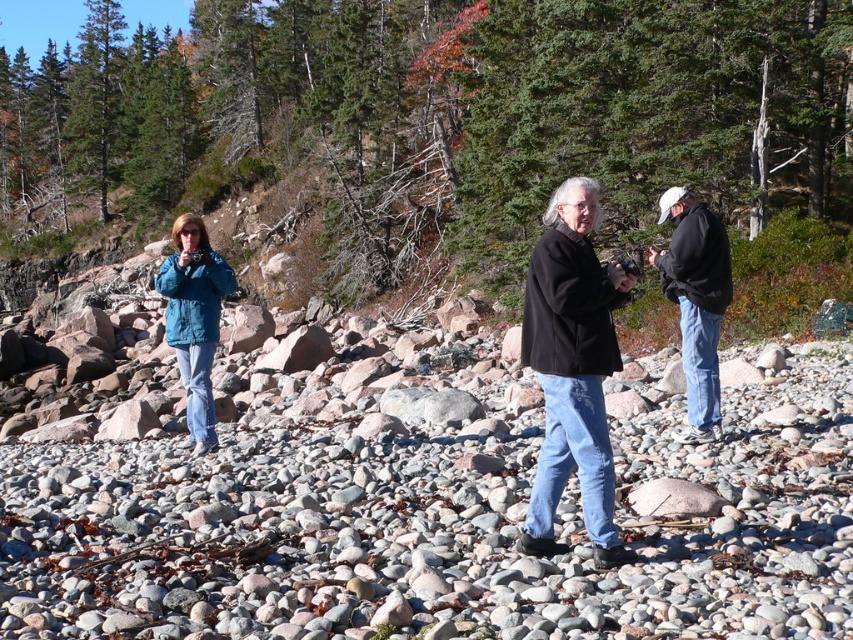
From the picture: You are standing at the point with coordinates point (701, 230) and want to walk towards the point with coordinates point (602, 554). Given the rocky terrain, will you have to move forward or backward to reach your destination?

Since point (602, 554) is in front of point (701, 230), you will need to move forward to reach it.

You are standing on the rocky beach and want to take a photo of both the black matte jacket at right and the teal matte jacket at left. Since you can only focus on one person at a time, which jacket should you focus on first to ensure the other is still in the frame?

You should focus on the black matte jacket at right first because it is in front of the teal matte jacket at left, so adjusting the focus to include both would require ensuring the foreground subject is properly framed.